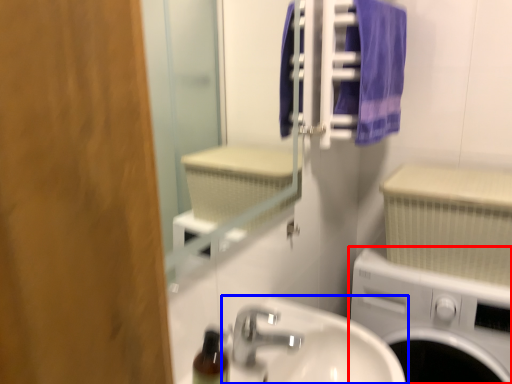
Question: Which object is closer to the camera taking this photo, washing machine (highlighted by a red box) or sink (highlighted by a blue box)?

Choices:
 (A) washing machine
 (B) sink

Answer: (B)